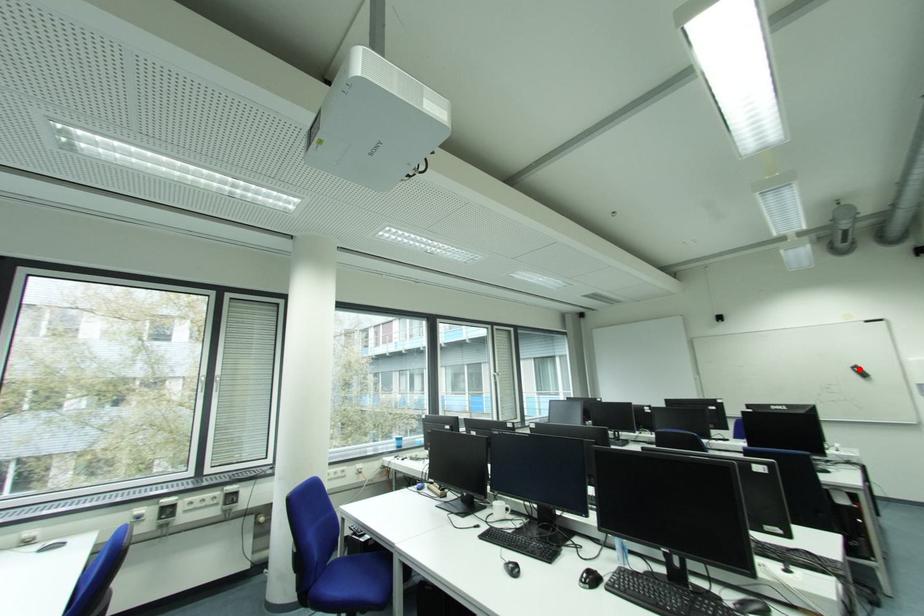
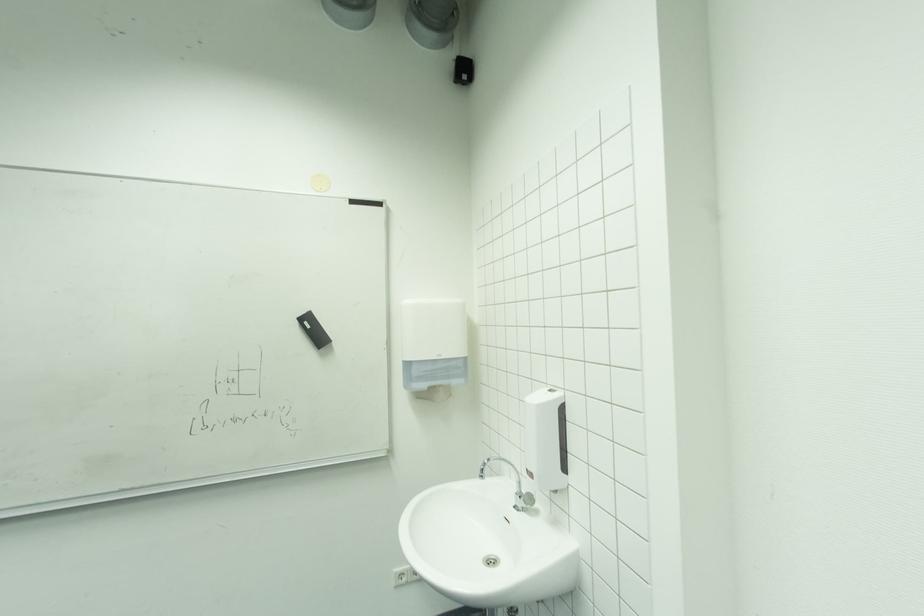
Question: I am providing you with two images of the same scene from different viewpoints. In image1, a red point is highlighted. Considering the same 3D point in image2, which of the following is correct?

Choices:
 (A) It is closer
 (B) It is farther

Answer: (B)